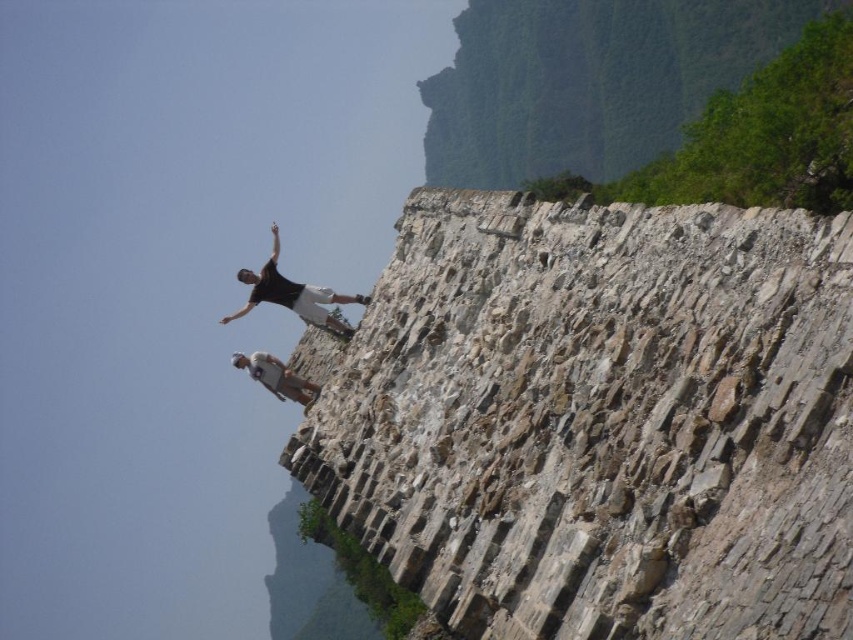
Question: In this image, where is dark gray stone rock climber at upper center located relative to white fabric shirt at upper center?

Choices:
 (A) left
 (B) right

Answer: (B)

Question: Which point is farther to the camera?

Choices:
 (A) gray stone wall at upper center
 (B) green leafy hillside at upper center
 (C) white fabric shirt at upper center
 (D) dark gray stone rock climber at upper center

Answer: (B)

Question: Which is nearer to the gray stone wall at upper center?

Choices:
 (A) green leafy hillside at upper center
 (B) white fabric shirt at upper center

Answer: (B)

Question: Can you confirm if gray stone wall at upper center is wider than white fabric shirt at upper center?

Choices:
 (A) yes
 (B) no

Answer: (B)

Question: Considering the real-world distances, which object is farthest from the dark gray stone rock climber at upper center?

Choices:
 (A) white fabric shirt at upper center
 (B) gray stone wall at upper center

Answer: (A)

Question: Does gray stone wall at upper center appear on the left side of green leafy hillside at upper center?

Choices:
 (A) no
 (B) yes

Answer: (B)